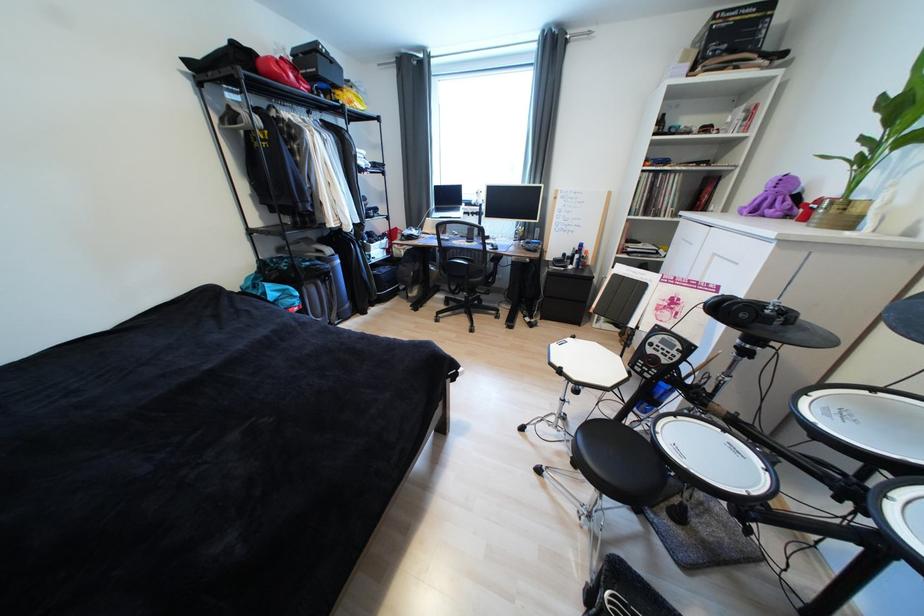
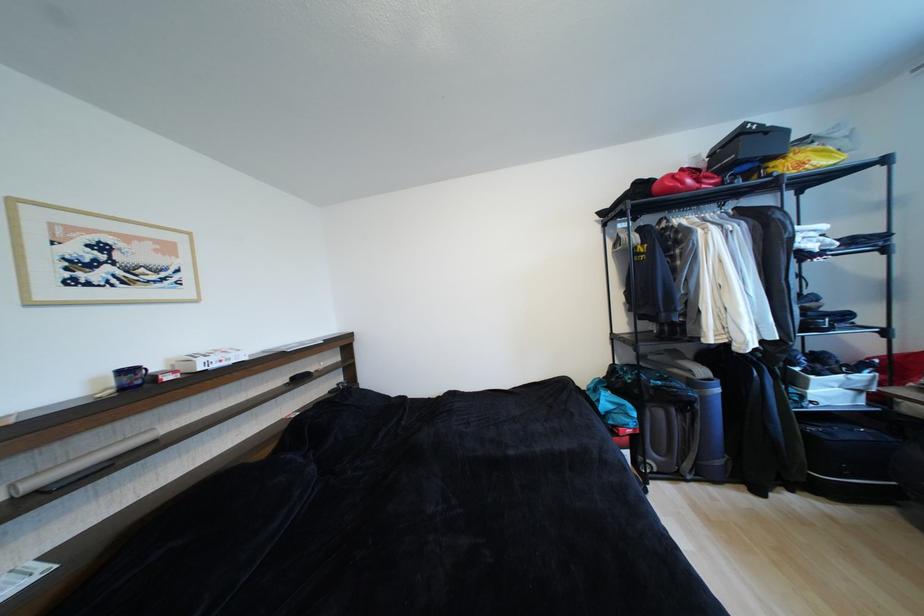
Question: The camera is either moving clockwise (left) or counter-clockwise (right) around the object. The first image is from the beginning of the video and the second image is from the end. Is the camera moving left or right when shooting the video?

Choices:
 (A) Left
 (B) Right

Answer: (B)